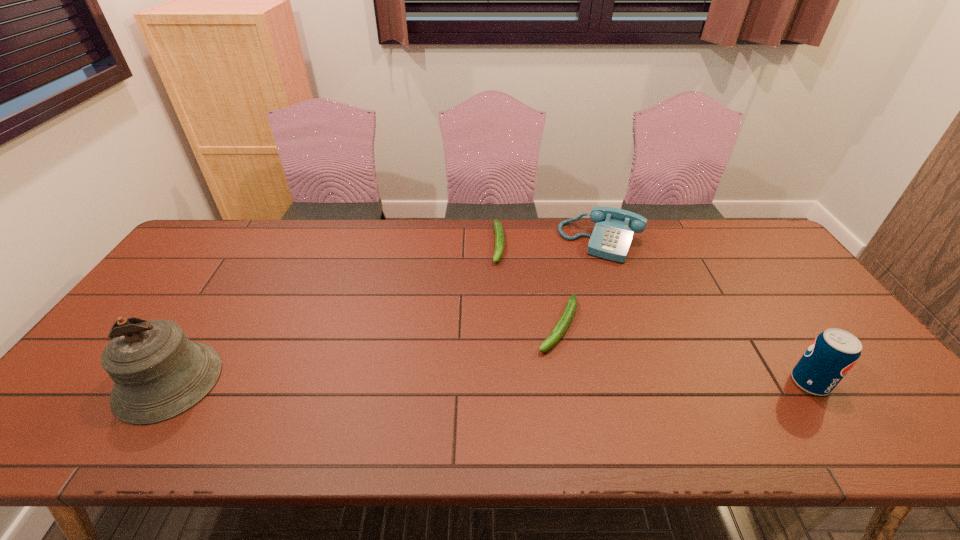
Locate an element on the screen. This screenshot has height=540, width=960. telephone present at the far edge is located at coordinates (611, 238).

The width and height of the screenshot is (960, 540). What are the coordinates of `bell present at the near edge` in the screenshot? It's located at (158, 373).

The image size is (960, 540). Identify the location of pop that is at the near edge. (831, 355).

The width and height of the screenshot is (960, 540). Identify the location of object present at the left edge. pos(158,373).

At what (x,y) coordinates should I click in order to perform the action: click on object that is at the right edge. Please return your answer as a coordinate pair (x, y). Looking at the image, I should click on (831, 355).

Find the location of a particular element. The width and height of the screenshot is (960, 540). object that is positioned at the near left corner is located at coordinates (158, 373).

Locate an element on the screen. The height and width of the screenshot is (540, 960). object located at the near right corner is located at coordinates (831, 355).

Identify the location of free space at the far edge. (256, 235).

Identify the location of vacant space at the near edge of the desktop. (429, 392).

The image size is (960, 540). Find the location of `vacant space at the right edge of the desktop`. vacant space at the right edge of the desktop is located at coordinates (815, 309).